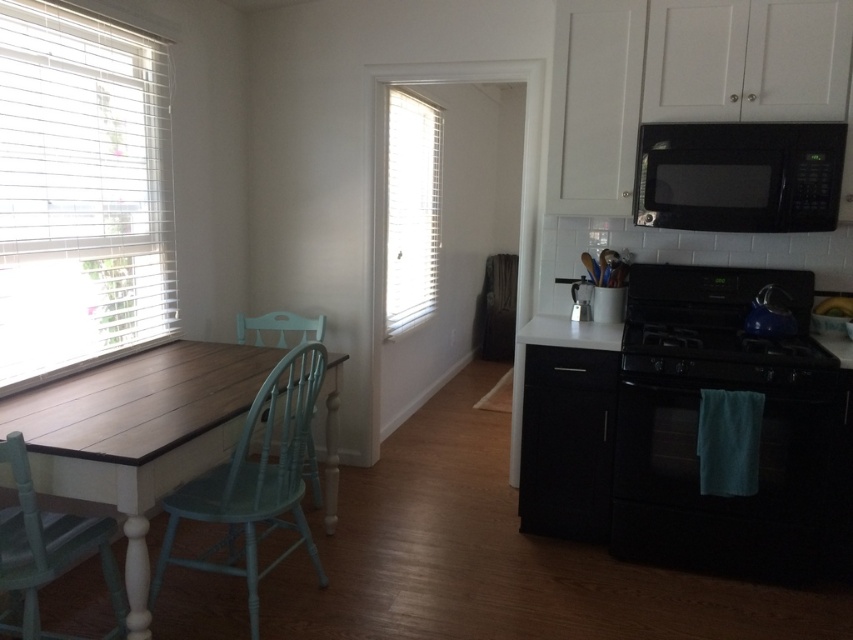
Question: Which point appears closest to the camera in this image?

Choices:
 (A) (779, 346)
 (B) (41, 188)
 (C) (294, 502)
 (D) (386, 198)

Answer: (C)

Question: Is light blue wood chair at left to the right of light blue wood chair at center from the viewer's perspective?

Choices:
 (A) no
 (B) yes

Answer: (B)

Question: Which point is closer to the camera?

Choices:
 (A) light blue wood chair at lower left
 (B) light blue wood chair at center
 (C) black matte microwave at upper right
 (D) black matte oven at lower right

Answer: (A)

Question: Is black matte oven at lower right bigger than black matte microwave at upper right?

Choices:
 (A) yes
 (B) no

Answer: (A)

Question: Does white blinds at left appear on the right side of black matte stove at lower right?

Choices:
 (A) yes
 (B) no

Answer: (B)

Question: Which object is farther from the camera taking this photo?

Choices:
 (A) light blue wood chair at center
 (B) black matte microwave at upper right

Answer: (A)